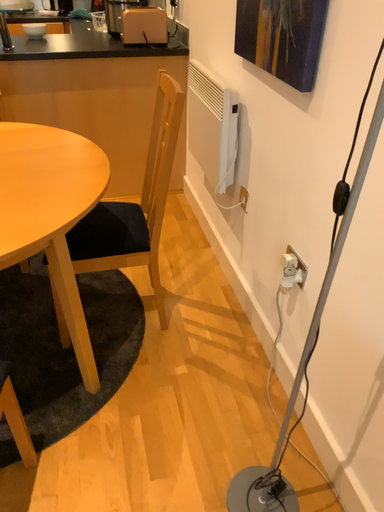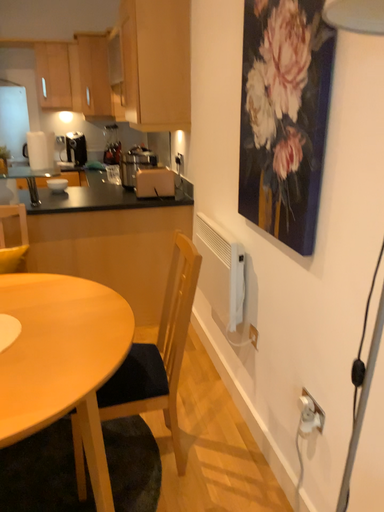
Question: How did the camera likely rotate when shooting the video?

Choices:
 (A) rotated downward
 (B) rotated upward

Answer: (B)